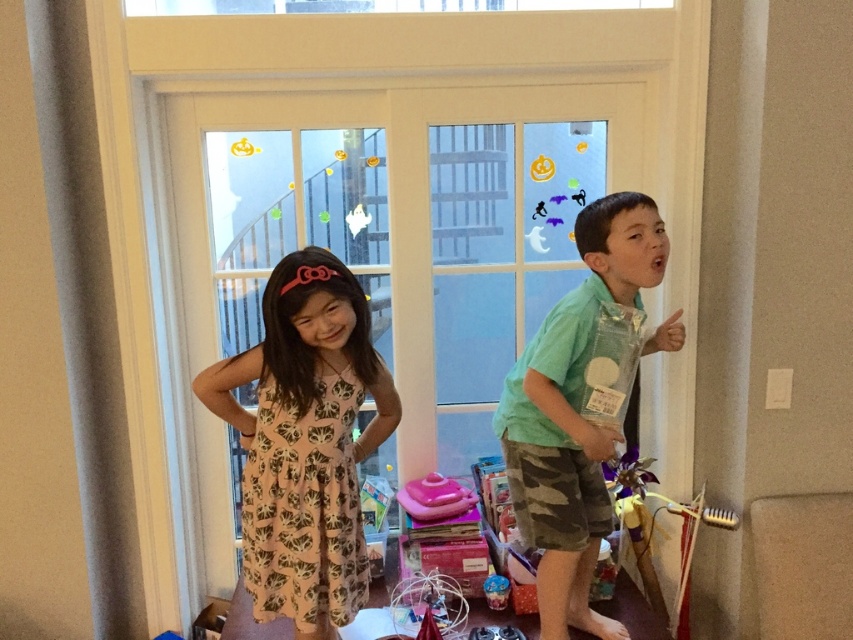
You are a photographer trying to capture the pink fabric dress at center in the image. Based on its coordinates, where should you position your camera to ensure it is centered in your shot?

The pink fabric dress at center is already positioned at the center coordinates of the image, so you should aim your camera directly at the center point to capture it perfectly.

You are a parent trying to determine which item is bigger between the green cotton shirt at right and the pink plastic toy at center. Based on the scene, which one is larger?

The green cotton shirt at right is larger than the pink plastic toy at center according to the description.

You are a photographer trying to capture a photo of the two pink items in the image. You want to arrange them so that the pink fabric dress at center is to the right of the pink plastic toy at center. Is their current arrangement in the image suitable for your requirement?

The pink fabric dress at center is positioned on the left side of the pink plastic toy at center, so their current arrangement is not suitable because the dress needs to be to the right of the toy according to your requirement.